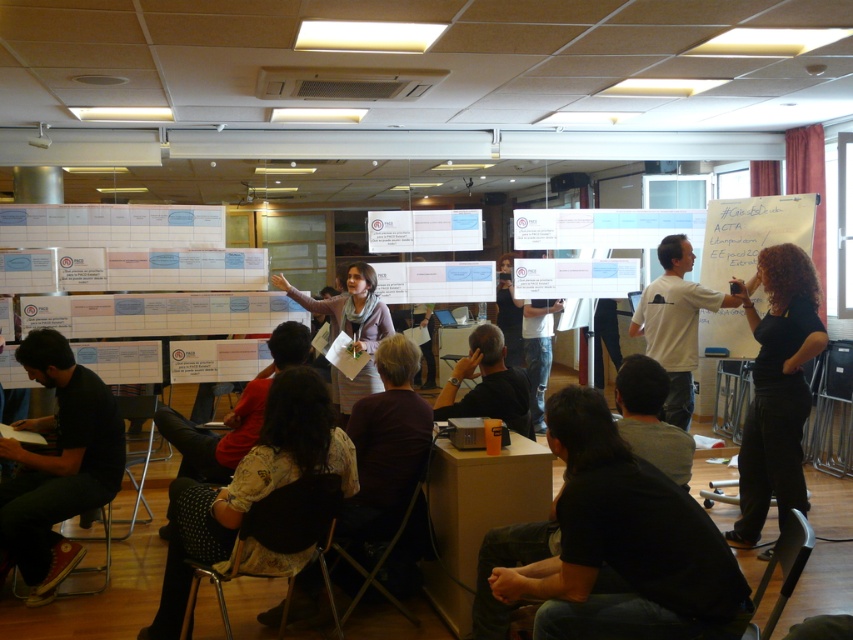
Question: Does dark gray fabric pants at lower left have a smaller size compared to black matte shirt at right?

Choices:
 (A) no
 (B) yes

Answer: (B)

Question: Can you confirm if dark gray fabric pants at lower left is positioned below white t-shirt at center?

Choices:
 (A) yes
 (B) no

Answer: (A)

Question: Where is dark gray fabric pants at lower left located in relation to black matte shirt at right in the image?

Choices:
 (A) left
 (B) right

Answer: (A)

Question: Estimate the real-world distances between objects in this image. Which object is closer to the dark gray fabric pants at lower left?

Choices:
 (A) white paperboard at upper right
 (B) white t-shirt at center
 (C) matte gray sweater at center
 (D) black matte shirt at right

Answer: (C)

Question: Which point is farther to the camera?

Choices:
 (A) matte gray sweater at center
 (B) white paperboard at upper right
 (C) dark gray fabric pants at lower left
 (D) white t-shirt at center

Answer: (B)

Question: Which of the following is the farthest from the observer?

Choices:
 (A) dark gray fabric pants at lower left
 (B) black matte shirt at right
 (C) white paperboard at upper right
 (D) matte gray sweater at center

Answer: (C)